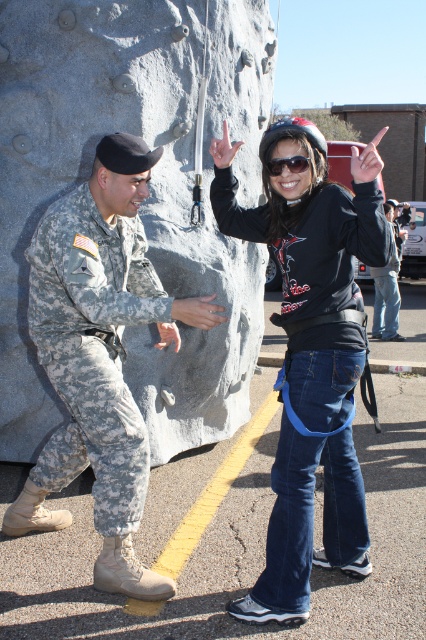
Question: Which point is closer to the camera taking this photo?

Choices:
 (A) (397, 301)
 (B) (89, 60)

Answer: (B)

Question: Does white matte finger at upper right appear under sunglasses at center?

Choices:
 (A) no
 (B) yes

Answer: (A)

Question: Is black matte hoodie at center positioned behind camouflage fabric uniform at left?

Choices:
 (A) no
 (B) yes

Answer: (A)

Question: Estimate the real-world distances between objects in this image. Which object is farther from the sunglasses at center?

Choices:
 (A) gray stone boulder at center
 (B) camouflage fabric uniform at left
 (C) black matte hoodie at center

Answer: (A)

Question: Can you confirm if black fabric jacket at right is positioned to the right of white matte hand at upper center?

Choices:
 (A) yes
 (B) no

Answer: (A)

Question: Which object appears farthest from the camera in this image?

Choices:
 (A) matte gray ring at center
 (B) gray stone boulder at center
 (C) black matte hoodie at center
 (D) white matte finger at upper right

Answer: (B)